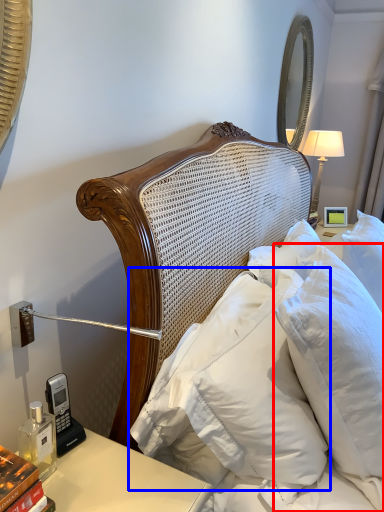
Question: Among these objects, which one is farthest to the camera, pillow (highlighted by a red box) or pillow (highlighted by a blue box)?

Choices:
 (A) pillow
 (B) pillow

Answer: (B)